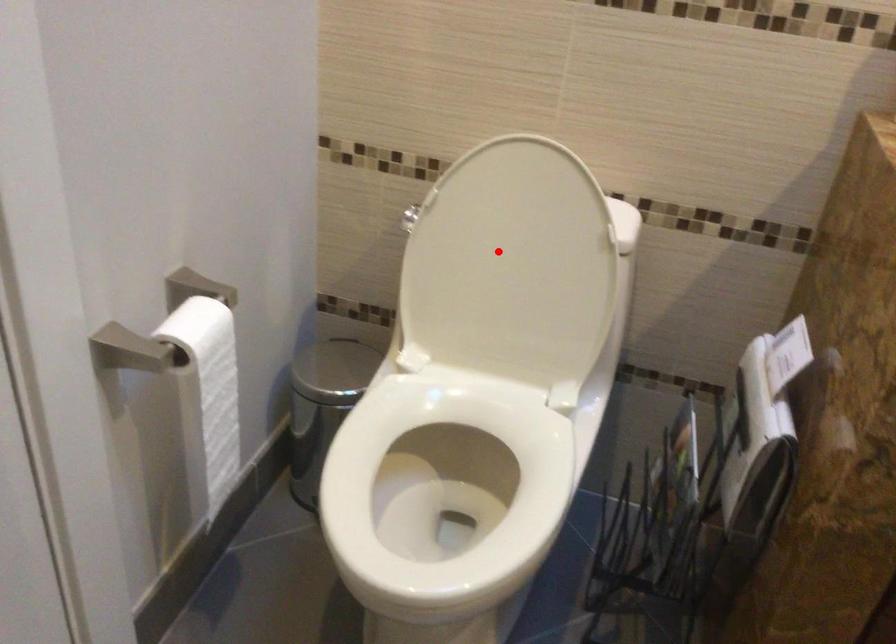
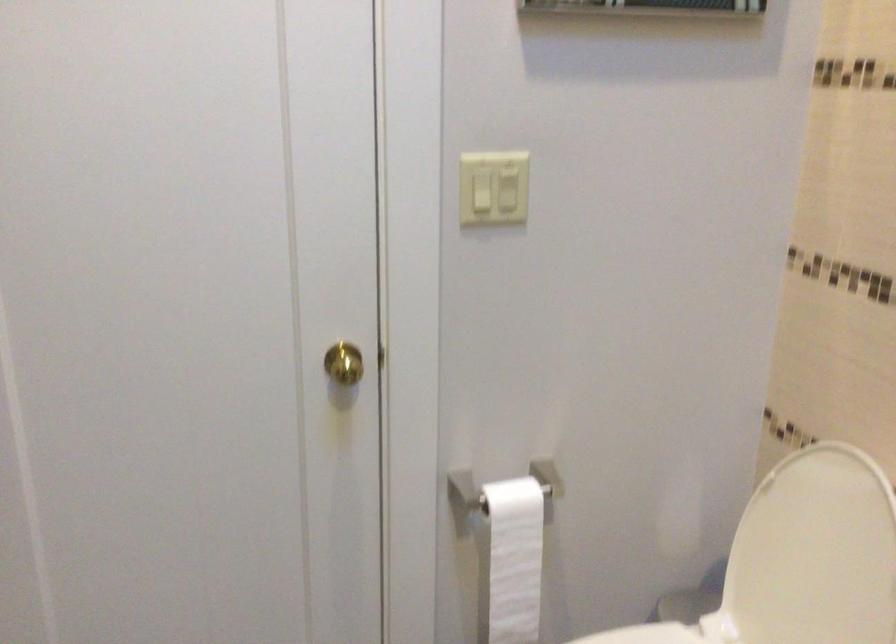
Find the pixel in the second image that matches the highlighted location in the first image.

(813, 554)